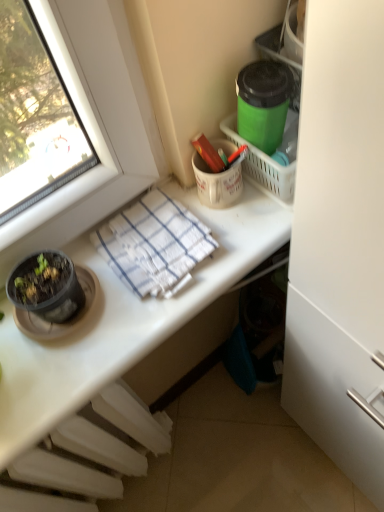
The width and height of the screenshot is (384, 512). What are the coordinates of `blank space situated above white woven towel at center (from a real-world perspective)` in the screenshot? It's located at [156, 236].